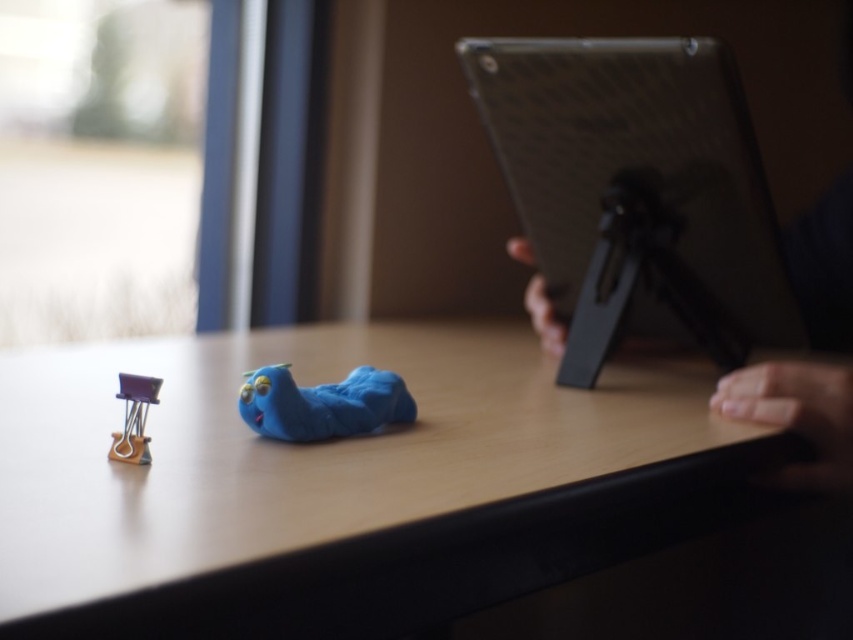
You are standing 3 feet away from the desk and want to pick up the matte black tablet at right. Can you reach it without moving your feet?

The matte black tablet at right is 32.42 inches from the viewer. Since 3 feet equals 36 inches, you are 3.58 inches closer than the tablet, so you can reach it without moving your feet.

You have a small toy that needs to be placed exactly 9 inches away from the table. Can you determine if the matte plastic toy at center is positioned correctly relative to the matte plastic table at center?

The matte plastic table at center and matte plastic toy at center are 8.79 inches apart from each other, which is less than 9 inches. Therefore, the matte plastic toy at center is not positioned correctly as it needs to be exactly 9 inches away from the matte plastic table at center.